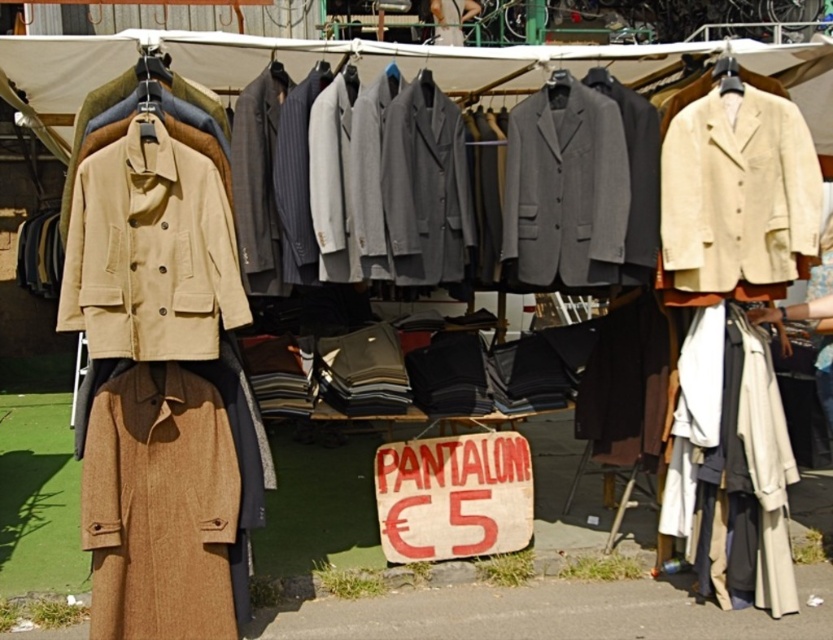
You are a customer at the clothing stall and want to choose between the beige corduroy blazer at upper right and the beige fabric coat at right. Which one is more suitable if you prefer a slimmer fit?

The beige corduroy blazer at upper right is thinner than the beige fabric coat at right, so it would be more suitable for a slimmer fit.

You are a customer at the outdoor clothing market stall. You want to buy a beige coat and a beige blazer. Which one is larger in size between the beige cotton coat at left and the beige corduroy blazer at upper right?

The beige cotton coat at left is bigger than the beige corduroy blazer at upper right.